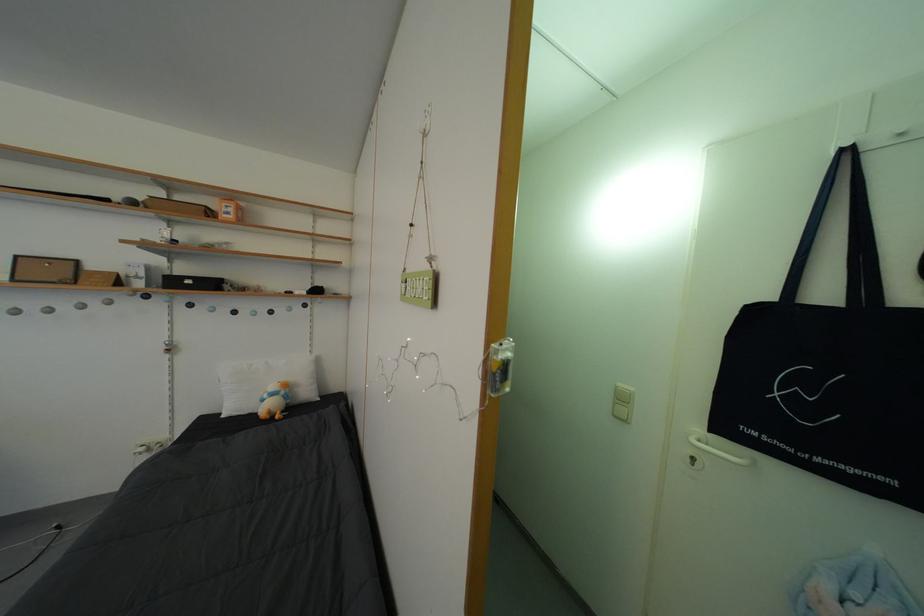
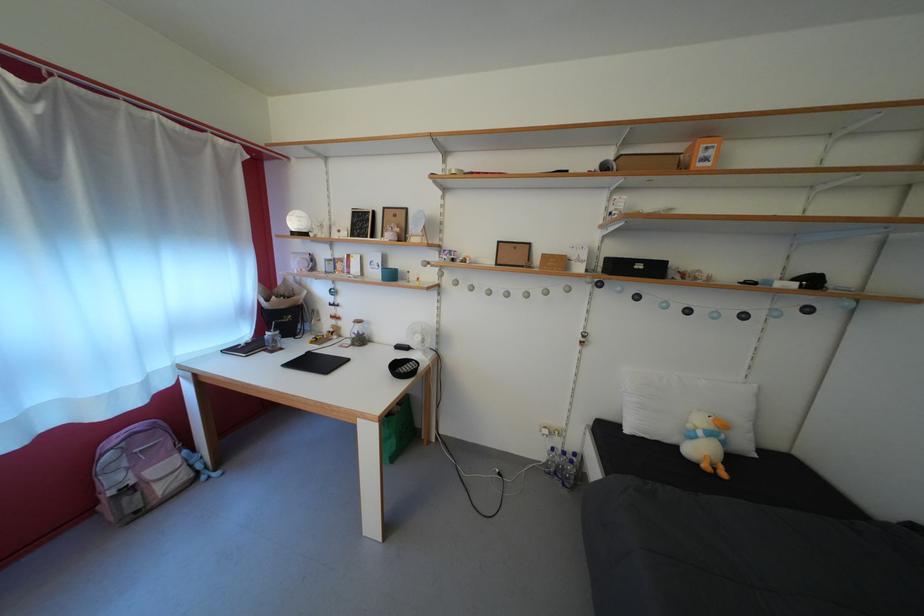
Where in the second image is the point corresponding to pixel 295 403 from the first image?

(732, 448)